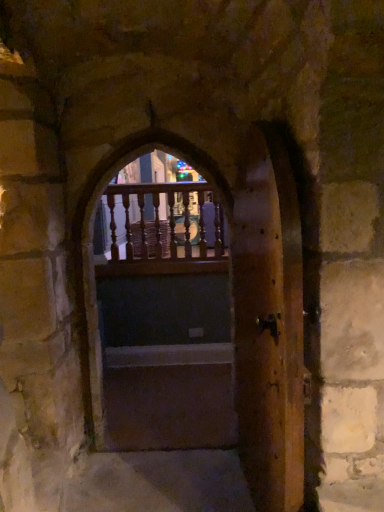
Question: Is wooden door at center, acting as the first door starting from the left, to the left or to the right of wooden balusters at center in the image?

Choices:
 (A) left
 (B) right

Answer: (B)

Question: From the image's perspective, is wooden door at center, the second door positioned from the right, positioned above or below wooden balusters at center?

Choices:
 (A) below
 (B) above

Answer: (A)

Question: Estimate the real-world distances between objects in this image. Which object is closer to the wooden door at center, acting as the first door starting from the left?

Choices:
 (A) dark wood door at center
 (B) wooden door at center, the 2th door in the left-to-right sequence
 (C) wooden balusters at center

Answer: (A)

Question: Estimate the real-world distances between objects in this image. Which object is closer to the wooden door at center, the 2th door in the left-to-right sequence?

Choices:
 (A) wooden door at center, acting as the first door starting from the left
 (B) wooden balusters at center
 (C) dark wood door at center

Answer: (C)